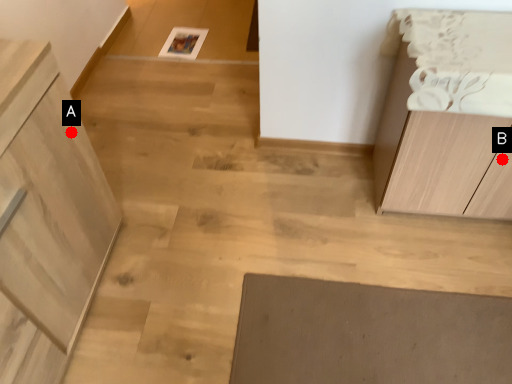
Question: Two points are circled on the image, labeled by A and B beside each circle. Among these points, which one is farthest from the camera?

Choices:
 (A) A is further
 (B) B is further

Answer: (B)